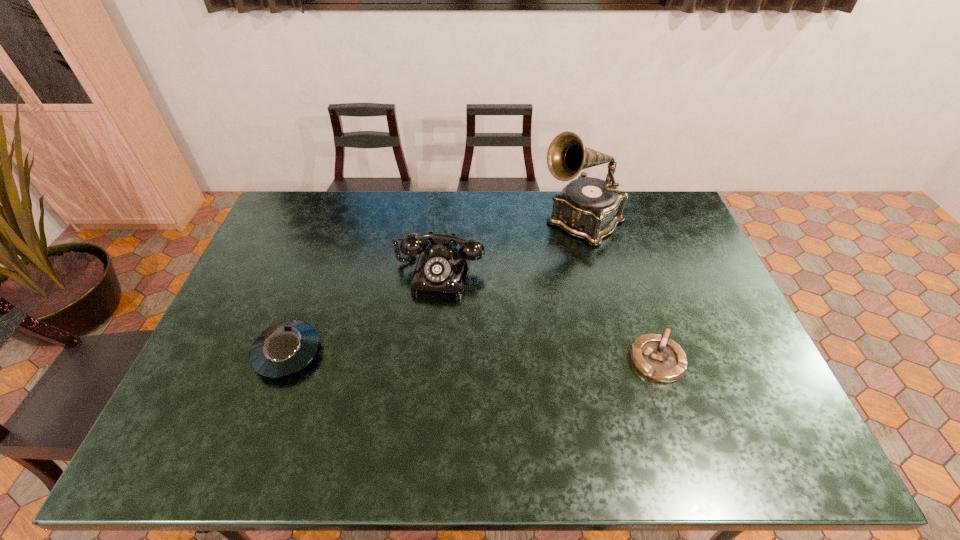
At what (x,y) coordinates should I click in order to perform the action: click on vacant area that lies between the ashtray and the third object from right to left. Please return your answer as a coordinate pair (x, y). The height and width of the screenshot is (540, 960). Looking at the image, I should click on (548, 315).

Locate an element on the screen. The image size is (960, 540). object that is the second closest to the phonograph record is located at coordinates (658, 358).

Where is `the third closest object to the second tallest object`? the third closest object to the second tallest object is located at coordinates (658, 358).

Find the location of a particular element. This screenshot has height=540, width=960. free location that satisfies the following two spatial constraints: 1. on the back side of the leftmost object; 2. on the left side of the phonograph record is located at coordinates (335, 221).

Find the location of a particular element. The image size is (960, 540). vacant space that satisfies the following two spatial constraints: 1. on the front side of the shortest object; 2. on the right side of the second object from left to right is located at coordinates (432, 359).